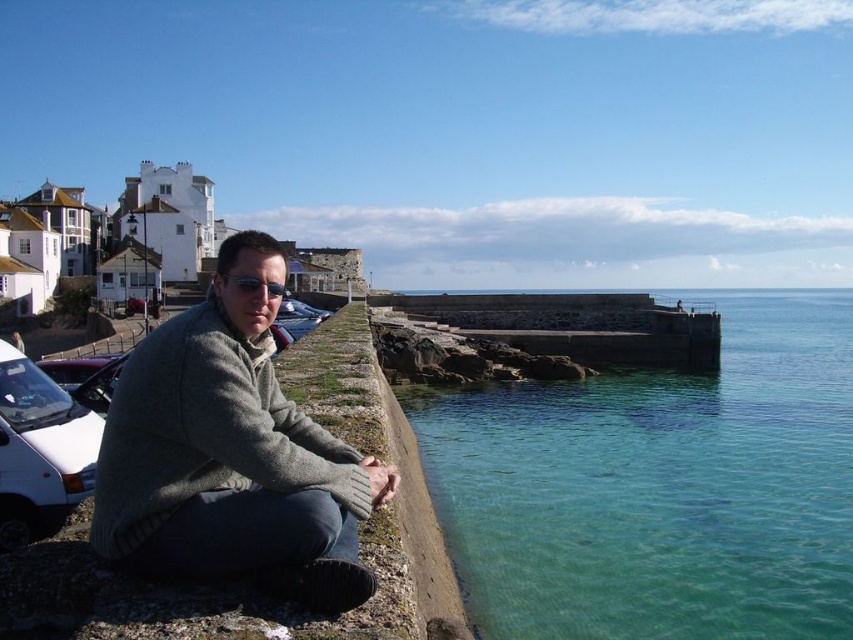
Question: Is clear glass water at lower right thinner than gray wool sweater at center?

Choices:
 (A) yes
 (B) no

Answer: (B)

Question: Which of the following is the farthest from the observer?

Choices:
 (A) (198, 570)
 (B) (611, 422)

Answer: (B)

Question: Is clear glass water at lower right above gray wool sweater at center?

Choices:
 (A) yes
 (B) no

Answer: (A)

Question: In this image, where is clear glass water at lower right located relative to gray wool sweater at center?

Choices:
 (A) right
 (B) left

Answer: (A)